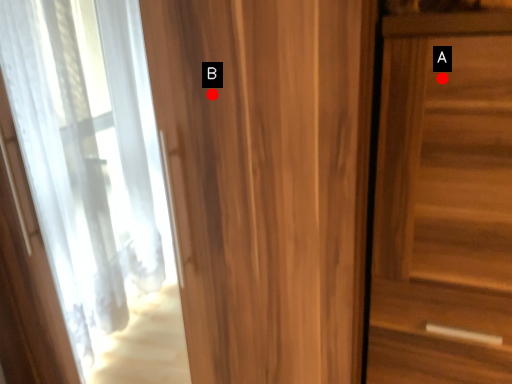
Question: Two points are circled on the image, labeled by A and B beside each circle. Which point is farther to the camera?

Choices:
 (A) A is further
 (B) B is further

Answer: (B)